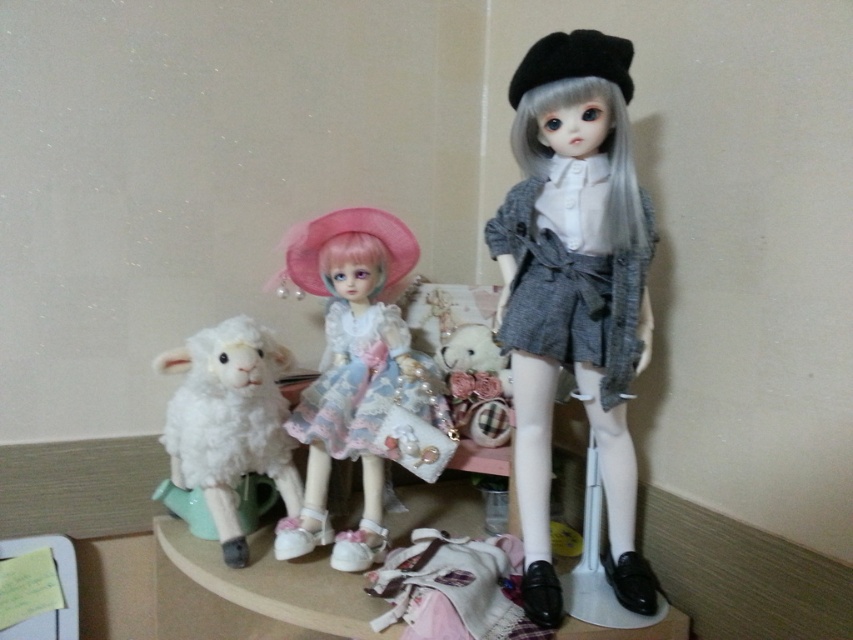
Question: Can you confirm if matte gray fabric dress at center is positioned above fluffy white sheep at center?

Choices:
 (A) no
 (B) yes

Answer: (B)

Question: Which is farther from the fluffy white sheep at center?

Choices:
 (A) white fluffy sheep at left
 (B) matte gray fabric dress at center

Answer: (A)

Question: Considering the real-world distances, which object is closest to the matte gray fabric dress at center?

Choices:
 (A) white fluffy sheep at left
 (B) fluffy white sheep at center

Answer: (B)

Question: Which point is farther from the camera taking this photo?

Choices:
 (A) (495, 406)
 (B) (357, 534)
 (C) (637, 188)
 (D) (180, 388)

Answer: (A)

Question: Can you confirm if white fluffy sheep at left is bigger than fluffy white sheep at center?

Choices:
 (A) yes
 (B) no

Answer: (A)

Question: Considering the relative positions of white fluffy sheep at left and fluffy white sheep at center in the image provided, where is white fluffy sheep at left located with respect to fluffy white sheep at center?

Choices:
 (A) right
 (B) left

Answer: (B)